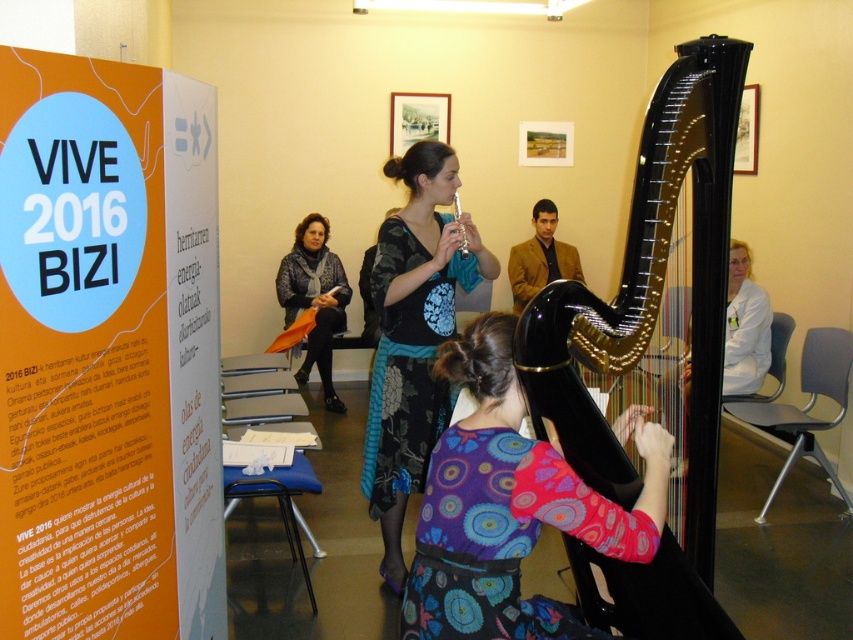
You are a photographer setting up for a concert. You need to position a tall camera stand that requires 2 meters of vertical space. Given the height of the glossy black harp at center and the knitted gray scarf at center, will the camera stand fit in the space between them?

The glossy black harp at center is not as tall as the knitted gray scarf at center, so the camera stand requiring 2 meters of vertical space may not fit between them if the height difference is less than 2 meters. However, without specific measurements, it is uncertain.

You are an event planner organizing a music performance. You need to decide which object, the orange paper poster at upper left or the matte silver flute at center, should be placed in a prominent position to attract attention. Based on their sizes, which one would be more effective?

The orange paper poster at upper left is bigger than the matte silver flute at center, so it would be more effective in attracting attention due to its larger size.

You are attending a musical performance in the described room. There is an orange paper poster at upper left. Can you see the poster from where you are sitting?

The orange paper poster at upper left is located at point (107, 353), so yes, it is visible from your current position as it is placed in the upper left area of the room.